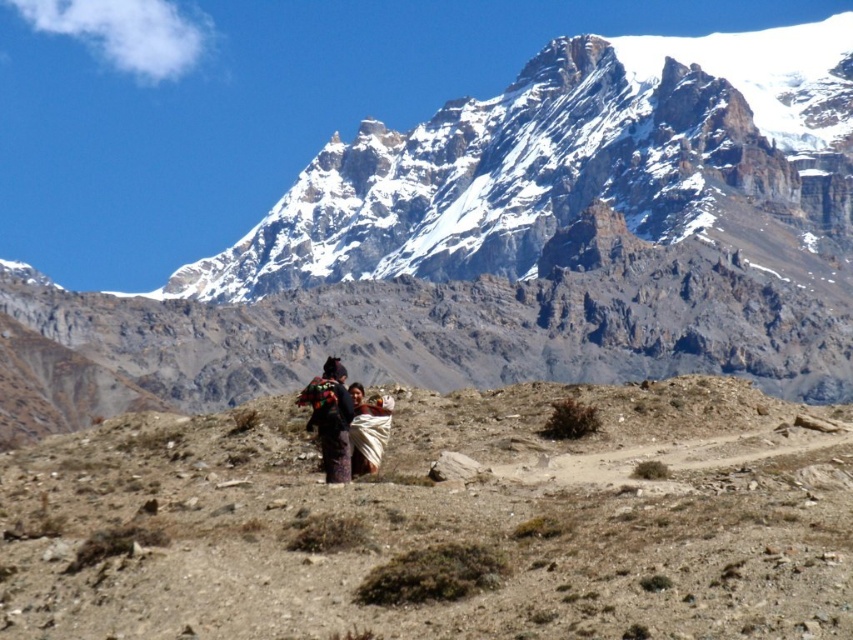
Question: Considering the relative positions of snowy granite mountain range at upper center and multicolored woven shawl at center in the image provided, where is snowy granite mountain range at upper center located with respect to multicolored woven shawl at center?

Choices:
 (A) left
 (B) right

Answer: (B)

Question: Which point is closer to the camera?

Choices:
 (A) [752, 470]
 (B) [322, 387]
 (C) [426, 310]

Answer: (A)

Question: Which object is closer to the camera taking this photo?

Choices:
 (A) brown textured hillside at center
 (B) multicolored woven shawl at center
 (C) snowy granite mountain range at upper center

Answer: (A)

Question: Is snowy granite mountain range at upper center closer to the viewer compared to brown textured hillside at center?

Choices:
 (A) yes
 (B) no

Answer: (B)

Question: Which point appears closest to the camera in this image?

Choices:
 (A) (376, 163)
 (B) (699, 474)

Answer: (B)

Question: Where is brown textured hillside at center located in relation to multicolored woven shawl at center in the image?

Choices:
 (A) below
 (B) above

Answer: (A)